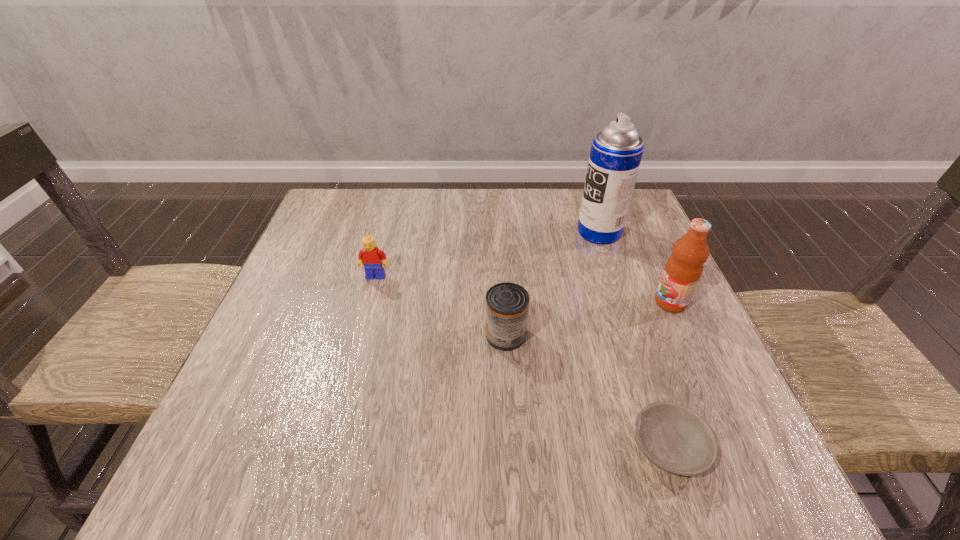
In order to click on free spot between the can and the leftmost object in this screenshot , I will do `click(441, 306)`.

Find the location of a particular element. vacant area that lies between the aerosol can and the bowl is located at coordinates (635, 340).

The width and height of the screenshot is (960, 540). Identify the location of object that stands as the fourth closest to the fourth farthest object. (616, 152).

Locate an element on the screen. The width and height of the screenshot is (960, 540). object that is the third closest to the fourth nearest object is located at coordinates (674, 438).

Identify the location of vacant space that satisfies the following two spatial constraints: 1. on the label side of the farthest object; 2. on the front side of the second nearest object. (634, 335).

I want to click on vacant area that satisfies the following two spatial constraints: 1. on the face of the bowl; 2. on the right side of the fourth nearest object, so click(x=331, y=447).

Where is `free space that satisfies the following two spatial constraints: 1. on the front side of the can; 2. on the left side of the shortest object`? The width and height of the screenshot is (960, 540). free space that satisfies the following two spatial constraints: 1. on the front side of the can; 2. on the left side of the shortest object is located at coordinates tap(512, 447).

The height and width of the screenshot is (540, 960). Identify the location of free space that satisfies the following two spatial constraints: 1. on the face of the second farthest object; 2. on the right side of the can. (360, 335).

Locate an element on the screen. The width and height of the screenshot is (960, 540). vacant region that satisfies the following two spatial constraints: 1. on the label side of the tallest object; 2. on the face of the second farthest object is located at coordinates (614, 276).